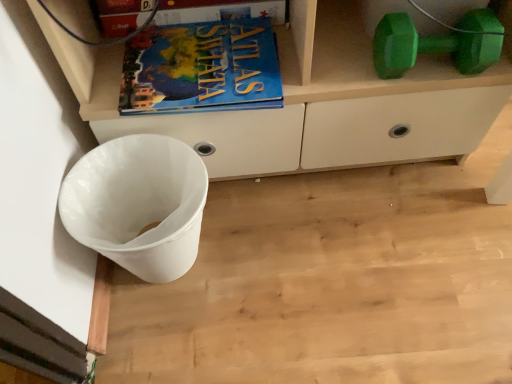
Question: Does blue matte book at upper center come in front of white plastic waste bin at lower left?

Choices:
 (A) no
 (B) yes

Answer: (A)

Question: From the image's perspective, is blue matte book at upper center under white plastic waste bin at lower left?

Choices:
 (A) no
 (B) yes

Answer: (A)

Question: Would you say blue matte book at upper center is outside white plastic waste bin at lower left?

Choices:
 (A) no
 (B) yes

Answer: (B)

Question: Is blue matte book at upper center aimed at white plastic waste bin at lower left?

Choices:
 (A) yes
 (B) no

Answer: (B)

Question: Does blue matte book at upper center have a greater width compared to white plastic waste bin at lower left?

Choices:
 (A) yes
 (B) no

Answer: (B)

Question: Considering the positions of blue matte atlas book at upper center and blue matte book at upper center in the image, is blue matte atlas book at upper center taller or shorter than blue matte book at upper center?

Choices:
 (A) tall
 (B) short

Answer: (B)

Question: Would you say blue matte atlas book at upper center is to the left or to the right of blue matte book at upper center in the picture?

Choices:
 (A) right
 (B) left

Answer: (A)

Question: Is point (214, 109) positioned closer to the camera than point (215, 0)?

Choices:
 (A) farther
 (B) closer

Answer: (B)

Question: From a real-world perspective, is blue matte atlas book at upper center above or below blue matte book at upper center?

Choices:
 (A) above
 (B) below

Answer: (B)

Question: From their relative heights in the image, would you say white plastic waste bin at lower left is taller or shorter than green rubber dumbbell at upper right?

Choices:
 (A) short
 (B) tall

Answer: (B)

Question: Do you think white plastic waste bin at lower left is within green rubber dumbbell at upper right, or outside of it?

Choices:
 (A) inside
 (B) outside

Answer: (B)

Question: Does point (74, 236) appear closer or farther from the camera than point (487, 21)?

Choices:
 (A) farther
 (B) closer

Answer: (B)

Question: Is white plastic waste bin at lower left wider or thinner than green rubber dumbbell at upper right?

Choices:
 (A) wide
 (B) thin

Answer: (A)

Question: Would you say blue matte atlas book at upper center is to the left or to the right of green rubber dumbbell at upper right in the picture?

Choices:
 (A) right
 (B) left

Answer: (B)

Question: Considering the positions of blue matte atlas book at upper center and green rubber dumbbell at upper right in the image, is blue matte atlas book at upper center taller or shorter than green rubber dumbbell at upper right?

Choices:
 (A) tall
 (B) short

Answer: (B)